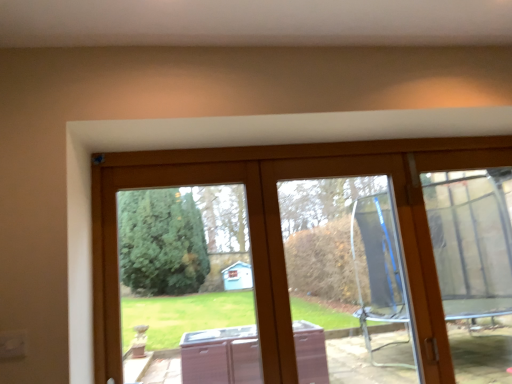
Question: Considering the positions of clear plastic screen door at right and clear glass door at center in the image, is clear plastic screen door at right wider or thinner than clear glass door at center?

Choices:
 (A) wide
 (B) thin

Answer: (A)

Question: Considering the positions of clear plastic screen door at right and clear glass door at center in the image, is clear plastic screen door at right taller or shorter than clear glass door at center?

Choices:
 (A) tall
 (B) short

Answer: (A)

Question: Estimate the real-world distances between objects in this image. Which object is closer to the clear plastic screen door at right?

Choices:
 (A) transparent glass door at center
 (B) clear glass door at center

Answer: (B)

Question: Which object is positioned farthest from the clear plastic screen door at right?

Choices:
 (A) clear glass door at center
 (B) transparent glass door at center

Answer: (B)